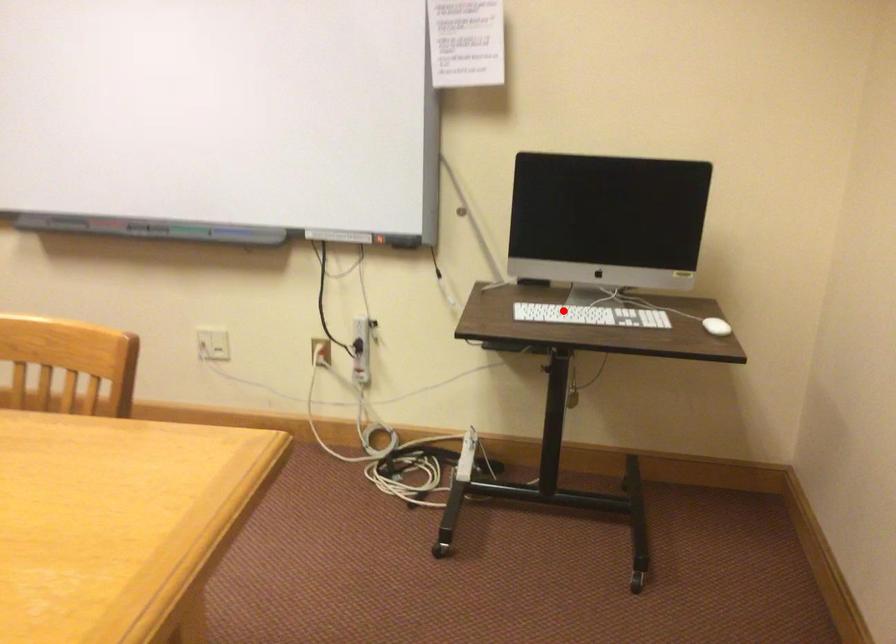
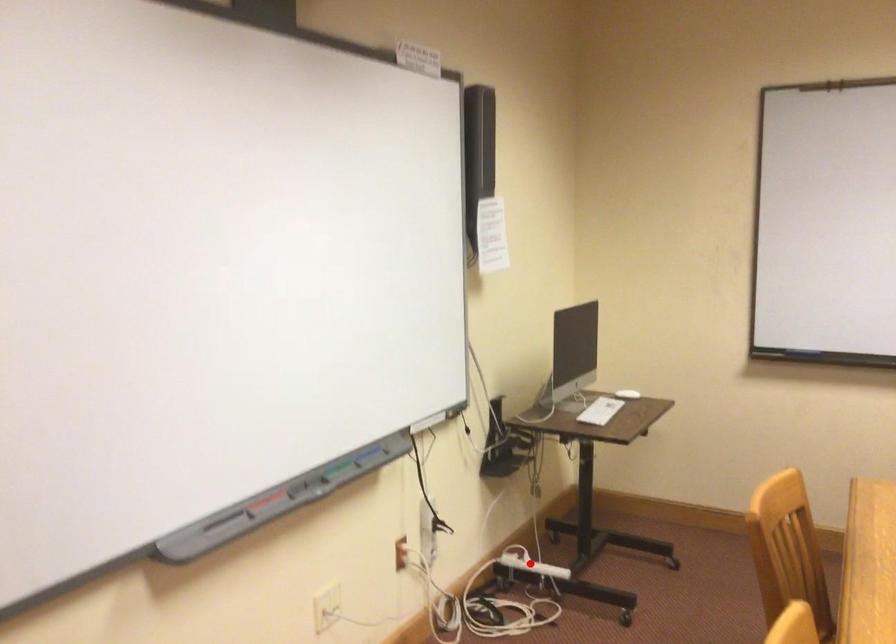
I am providing you with two images of the same scene from different viewpoints. A red point is marked on the first image and another point is marked on the second image. Is the marked point in image1 the same physical position as the marked point in image2?

No